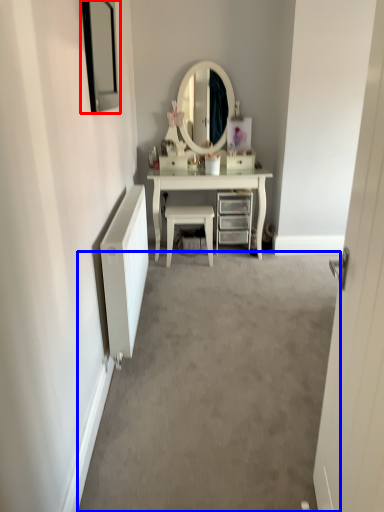
Question: Which of the following is the closest to the observer, picture frame (highlighted by a red box) or plain (highlighted by a blue box)?

Choices:
 (A) picture frame
 (B) plain

Answer: (B)